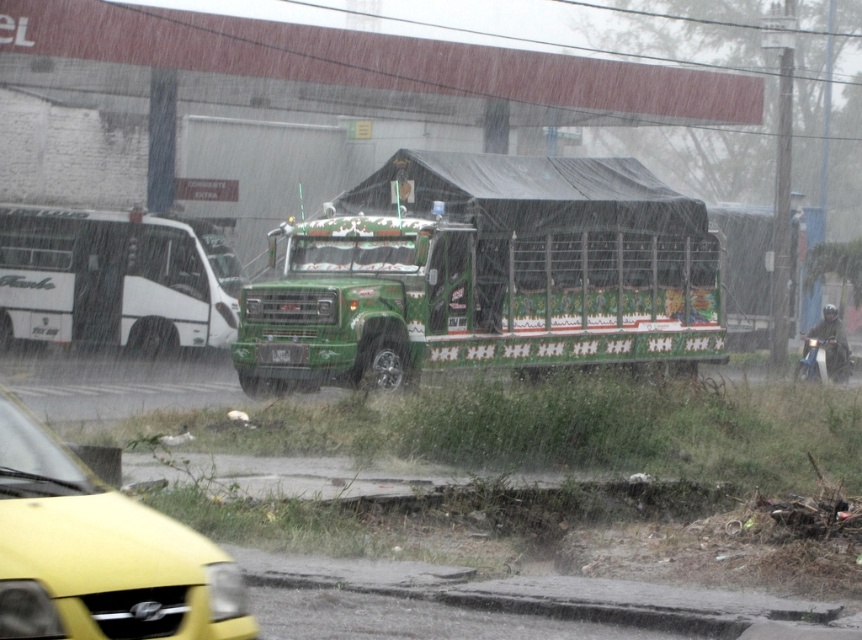
Question: Estimate the real-world distances between objects in this image. Which object is closer to the green painted metal trailer truck at center?

Choices:
 (A) yellow matte car at lower left
 (B) white matte bus at left

Answer: (B)

Question: Considering the real-world distances, which object is closest to the yellow matte car at lower left?

Choices:
 (A) green painted metal trailer truck at center
 (B) white matte bus at left

Answer: (A)

Question: Is green painted metal trailer truck at center above yellow matte car at lower left?

Choices:
 (A) yes
 (B) no

Answer: (A)

Question: Where is green painted metal trailer truck at center located in relation to yellow matte car at lower left in the image?

Choices:
 (A) above
 (B) below

Answer: (A)

Question: Among these objects, which one is nearest to the camera?

Choices:
 (A) green painted metal trailer truck at center
 (B) white matte bus at left

Answer: (A)

Question: Can you confirm if yellow matte car at lower left is positioned above white matte bus at left?

Choices:
 (A) yes
 (B) no

Answer: (B)